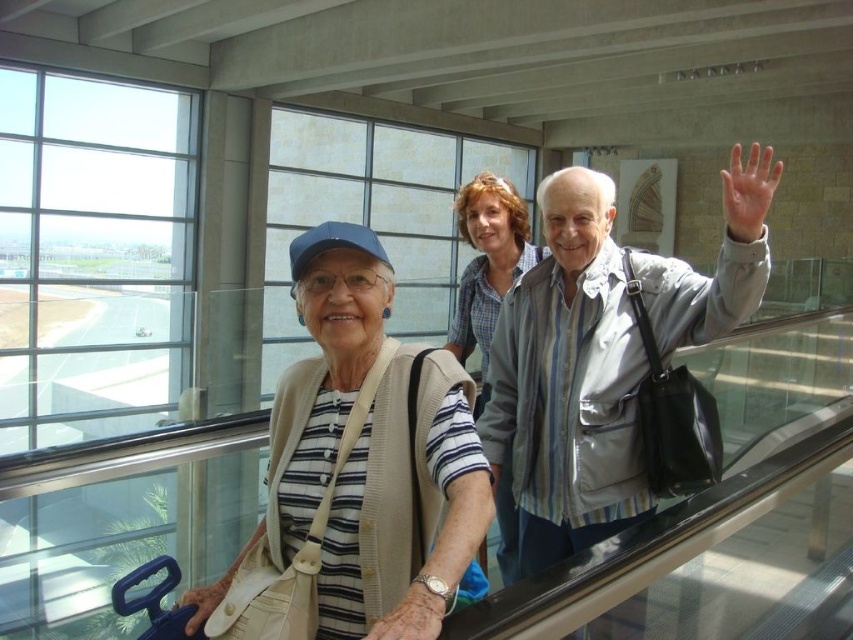
What is the color of the object located at the coordinates point (x=357, y=470)?

The object at point (x=357, y=470) is a matte beige sweater at center.

You are standing on the escalator and want to reach a point that is exactly 1.5 meters away from you. Is the point at coordinates point (328, 492) within that distance?

The distance of point (328, 492) from camera is 1.45 meters, so yes, the point is within 1.5 meters from your current position.